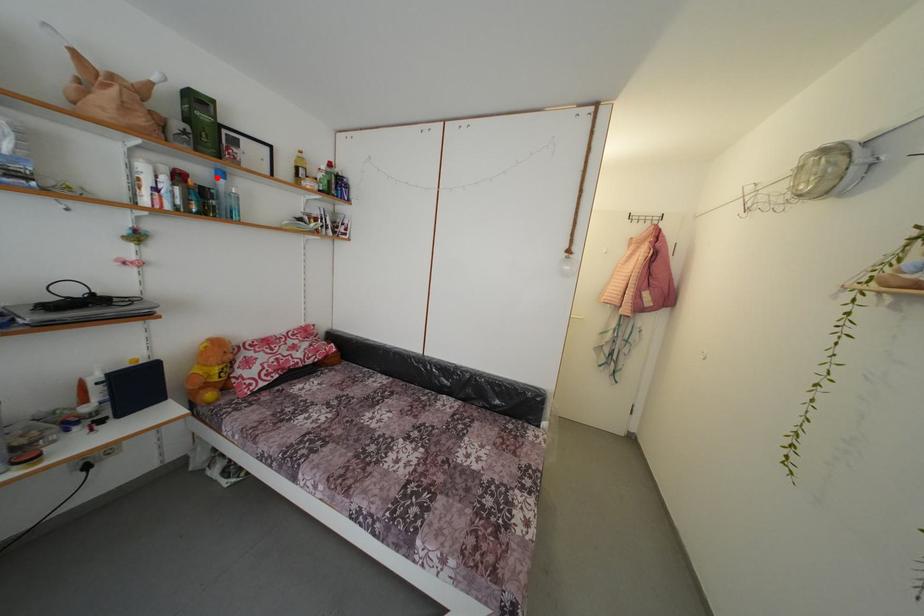
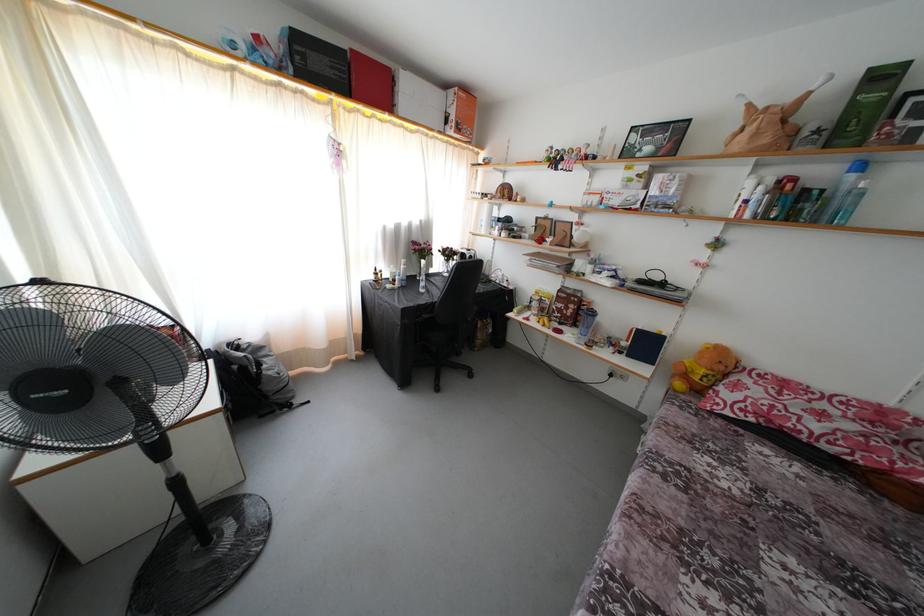
Where in the second image is the point corresponding to the highlighted location from the first image?

(849, 172)